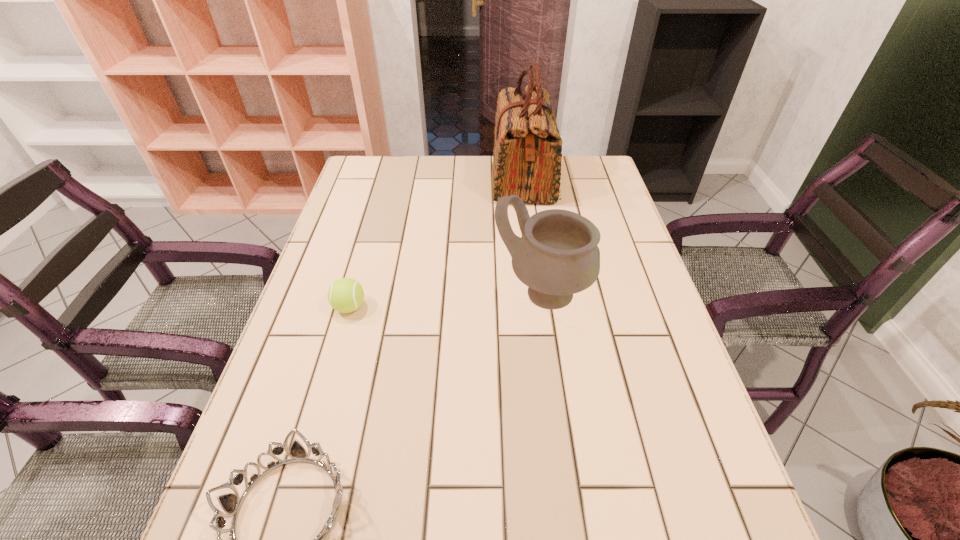
Find the location of a particular element. The height and width of the screenshot is (540, 960). free space that satisfies the following two spatial constraints: 1. on the open handle side of the pottery; 2. on the left side of the farthest object is located at coordinates (539, 293).

Where is `free spot that satisfies the following two spatial constraints: 1. on the open handle side of the pottery; 2. on the left side of the tallest object`? free spot that satisfies the following two spatial constraints: 1. on the open handle side of the pottery; 2. on the left side of the tallest object is located at coordinates (539, 293).

At what (x,y) coordinates should I click in order to perform the action: click on vacant space that satisfies the following two spatial constraints: 1. on the back side of the second tallest object; 2. on the open handle side of the farthest object. Please return your answer as a coordinate pair (x, y). Looking at the image, I should click on (526, 179).

Identify the location of blank area in the image that satisfies the following two spatial constraints: 1. on the open handle side of the farthest object; 2. on the left side of the pottery. (539, 293).

Locate an element on the screen. free space that satisfies the following two spatial constraints: 1. on the open handle side of the farthest object; 2. on the left side of the pottery is located at coordinates (539, 293).